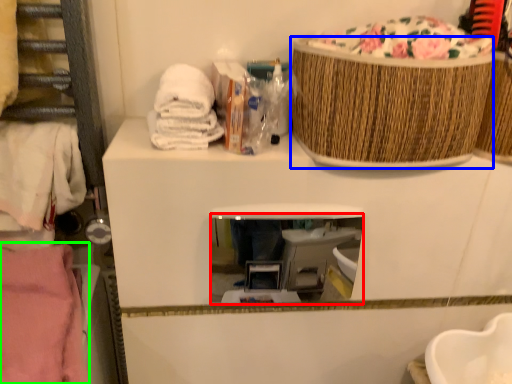
Question: Which object is the closest to the mirror (highlighted by a red box)? Choose among these: basket (highlighted by a blue box) or clothing (highlighted by a green box).

Choices:
 (A) basket
 (B) clothing

Answer: (A)